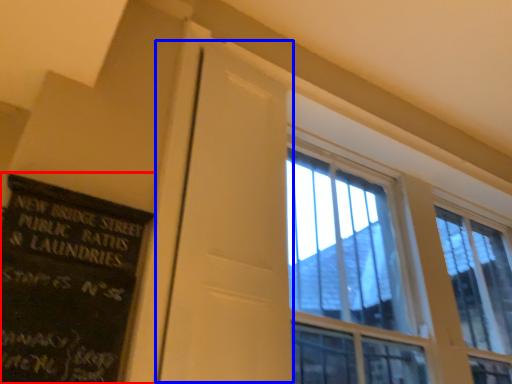
Question: Which object is closer to the camera taking this photo, bulletin board (highlighted by a red box) or screen door (highlighted by a blue box)?

Choices:
 (A) bulletin board
 (B) screen door

Answer: (A)